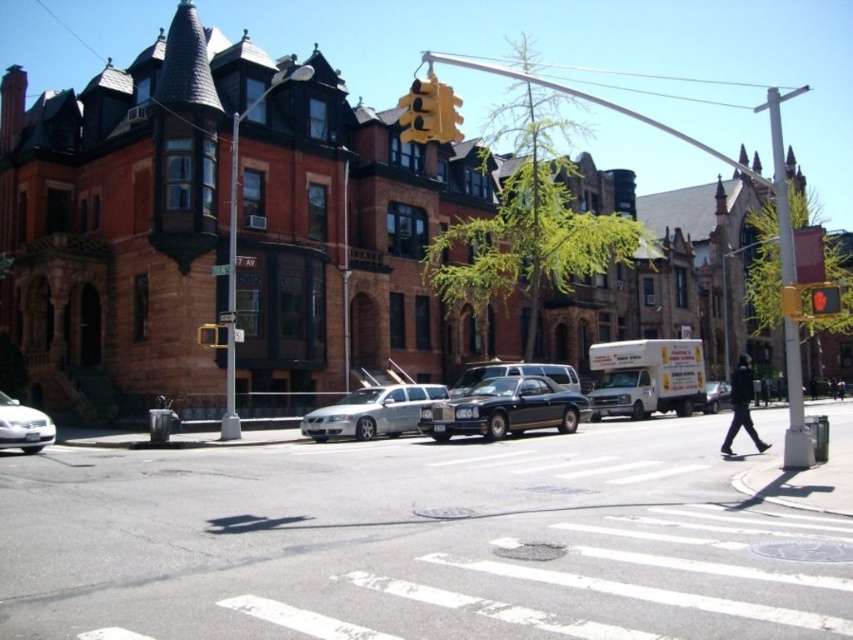
Question: Which object is farther from the camera taking this photo?

Choices:
 (A) metallic yellow traffic light at upper center
 (B) metallic yellow traffic light at center
 (C) shiny black sedan at center
 (D) white plastic pole at right

Answer: (C)

Question: Is silver metallic sedan at lower left thinner than metallic yellow traffic light at center?

Choices:
 (A) yes
 (B) no

Answer: (A)

Question: Considering the relative positions of silver metallic sedan at center and metallic yellow traffic light at upper center in the image provided, where is silver metallic sedan at center located with respect to metallic yellow traffic light at upper center?

Choices:
 (A) below
 (B) above

Answer: (A)

Question: Can you confirm if silver metallic sedan at center is bigger than yellow matte traffic light at upper center?

Choices:
 (A) no
 (B) yes

Answer: (A)

Question: Among these objects, which one is nearest to the camera?

Choices:
 (A) silver metallic sedan at center
 (B) shiny black sedan at center

Answer: (A)

Question: Which of the following is the farthest from the observer?

Choices:
 (A) metallic yellow traffic light at center
 (B) metallic yellow traffic light at upper center
 (C) white plastic pole at right
 (D) yellow metallic traffic light at upper center

Answer: (A)